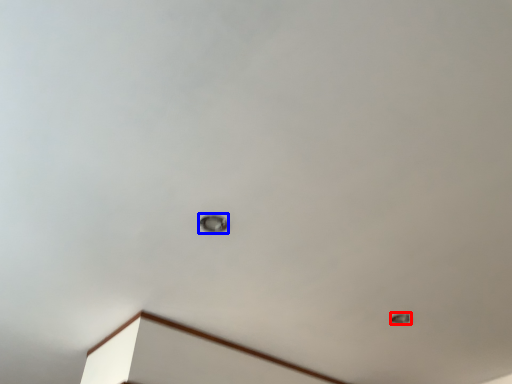
Question: Among these objects, which one is farthest to the camera, lamp (highlighted by a red box) or lamp (highlighted by a blue box)?

Choices:
 (A) lamp
 (B) lamp

Answer: (A)